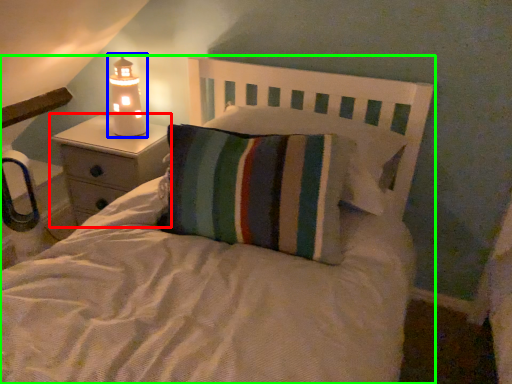
Question: Which is farther away from nightstand (highlighted by a red box)? lamp (highlighted by a blue box) or bed (highlighted by a green box)?

Choices:
 (A) lamp
 (B) bed

Answer: (B)